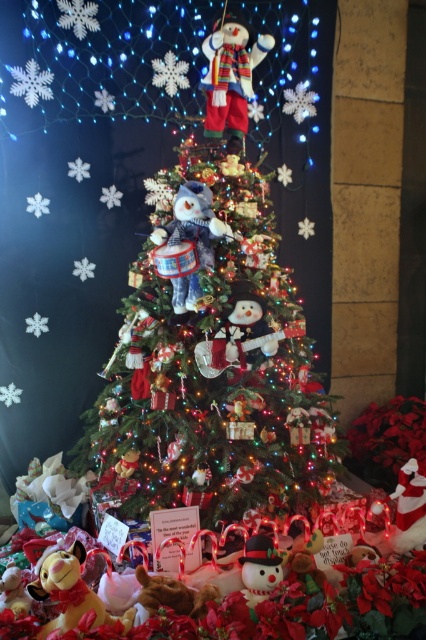
You are standing in front of the Christmas tree and want to place a new decoration. The fluffy blue plush is at point (190,240). Where should you place it to avoid blocking the snowman with a flag?

The fluffy blue plush at center is represented by point (190,240). To avoid blocking the snowman with a flag, place it away from the top area where the snowman with the flag is located.